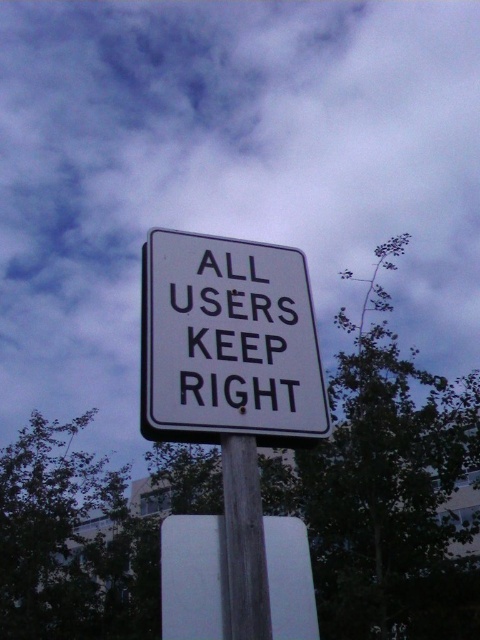
Between blackmaterial/texturetext at center and white matte sign at center, which one has less height?

Standing shorter between the two is white matte sign at center.

Who is higher up, blackmaterial/texturetext at center or white matte sign at center?

Positioned higher is blackmaterial/texturetext at center.

Who is more forward, (166,262) or (274,536)?

Point (274,536) is more forward.

This screenshot has height=640, width=480. What are the coordinates of `blackmaterial/texturetext at center` in the screenshot? It's located at (231, 323).

Can you confirm if blackmaterial/texturetext at center is positioned above wooden post at center?

Correct, blackmaterial/texturetext at center is located above wooden post at center.

Is blackmaterial/texturetext at center wider than wooden post at center?

Correct, the width of blackmaterial/texturetext at center exceeds that of wooden post at center.

The width and height of the screenshot is (480, 640). What do you see at coordinates (231, 323) in the screenshot?
I see `blackmaterial/texturetext at center` at bounding box center [231, 323].

This screenshot has height=640, width=480. Identify the location of blackmaterial/texturetext at center. (231, 323).

Which is behind, point (289, 627) or point (257, 611)?

The point (289, 627) is behind.

Where is `white matte sign at center`? white matte sign at center is located at coordinates (193, 577).